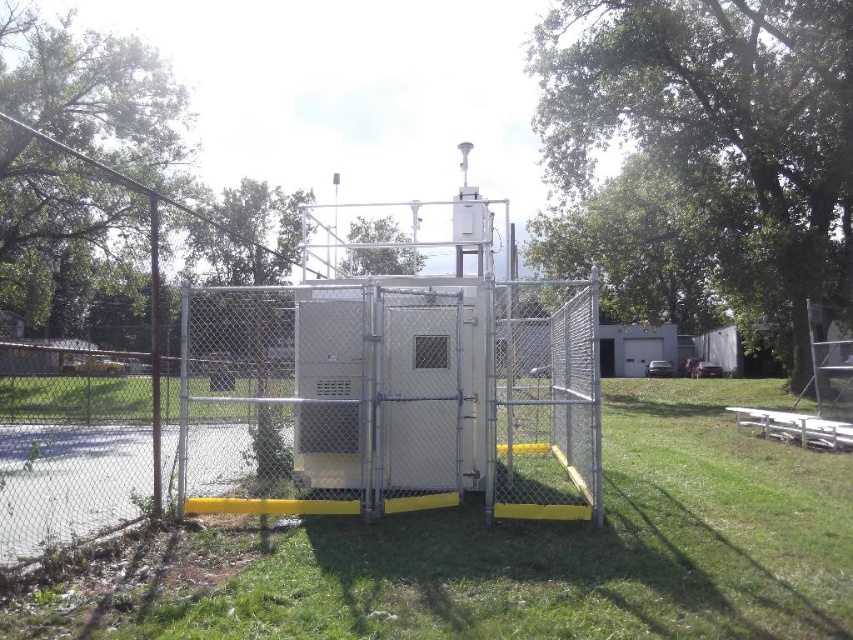
You are standing outside the fenced area and want to place a new item between the metallic gray cabinet at center and the white wooden picnic table at lower right. Which object should you position your item closer to if you want it to be nearer to the fence entrance located at the lower left corner?

The metallic gray cabinet at center is closer to the viewer than the white wooden picnic table at lower right. Since the fence entrance is at the lower left corner, positioning the item closer to the metallic gray cabinet at center would place it nearer to the entrance.